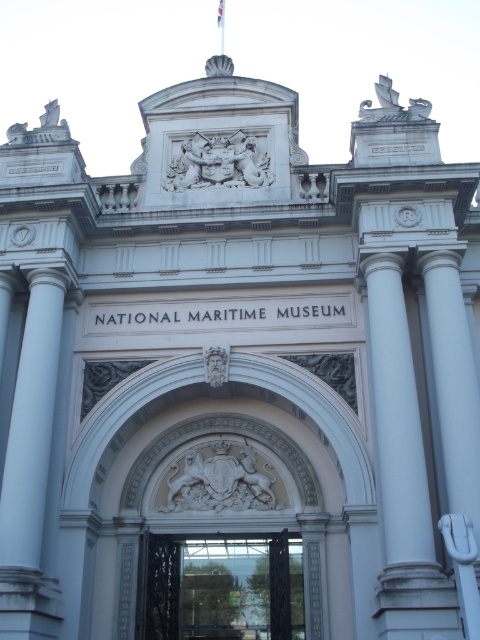
Question: Is white marble column at left positioned in front of black wrought iron gate at center?

Choices:
 (A) no
 (B) yes

Answer: (B)

Question: Can you confirm if white marble column at left is wider than black wrought iron gate at center?

Choices:
 (A) yes
 (B) no

Answer: (B)

Question: Which object appears closest to the camera in this image?

Choices:
 (A) white marble column at left
 (B) black wrought iron gate at center

Answer: (A)

Question: Is white marble column at left thinner than black wrought iron gate at center?

Choices:
 (A) yes
 (B) no

Answer: (A)

Question: Which point is closer to the camera?

Choices:
 (A) (250, 556)
 (B) (29, 374)

Answer: (B)